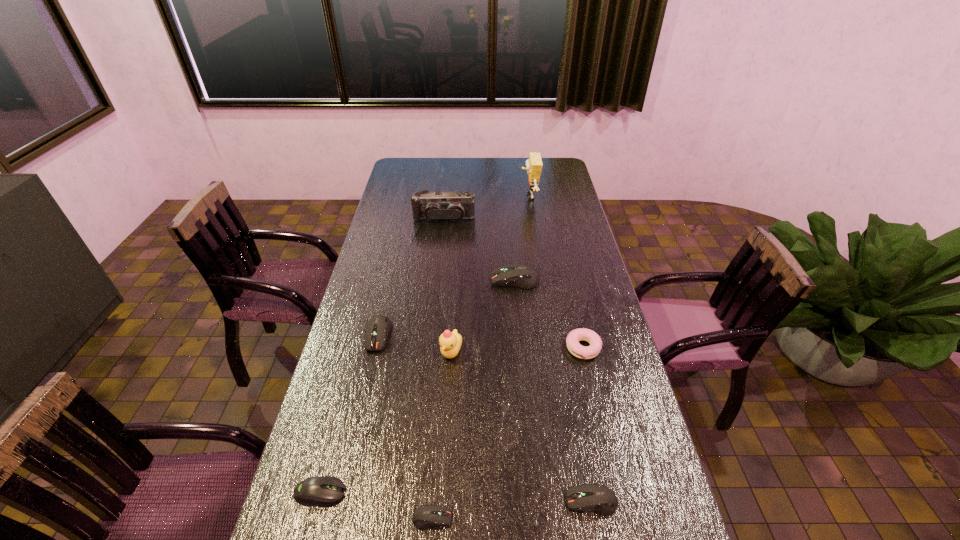
Image resolution: width=960 pixels, height=540 pixels. Identify the location of blank space located on the button of the farthest computer equipment. (382, 280).

This screenshot has width=960, height=540. Find the location of `free space located 0.050m on the button of the farthest computer equipment`. free space located 0.050m on the button of the farthest computer equipment is located at coordinates (477, 280).

You are a GUI agent. You are given a task and a screenshot of the screen. Output one action in this format:
    pyautogui.click(x=<x>, y=<y>)
    Task: Click on the free space located on the button of the farthest computer equipment
    
    Given the screenshot: What is the action you would take?
    pyautogui.click(x=437, y=280)

This screenshot has height=540, width=960. I want to click on free space located on the button of the fourth shortest computer equipment, so click(352, 448).

Where is `free location located on the front of the doughnut`? This screenshot has height=540, width=960. free location located on the front of the doughnut is located at coordinates (611, 469).

This screenshot has width=960, height=540. Identify the location of free space located on the button of the third biggest dark computer equipment. (519, 501).

This screenshot has height=540, width=960. I want to click on vacant position located 0.340m on the button of the third biggest dark computer equipment, so click(x=420, y=501).

What are the coordinates of `vacant space located on the button of the third biggest dark computer equipment` in the screenshot? It's located at (497, 501).

In order to click on free space located on the wheel side of the gray computer mouse in this screenshot , I will do `click(485, 492)`.

I want to click on vacant space located 0.270m on the button of the third computer equipment from right to left, so click(x=570, y=518).